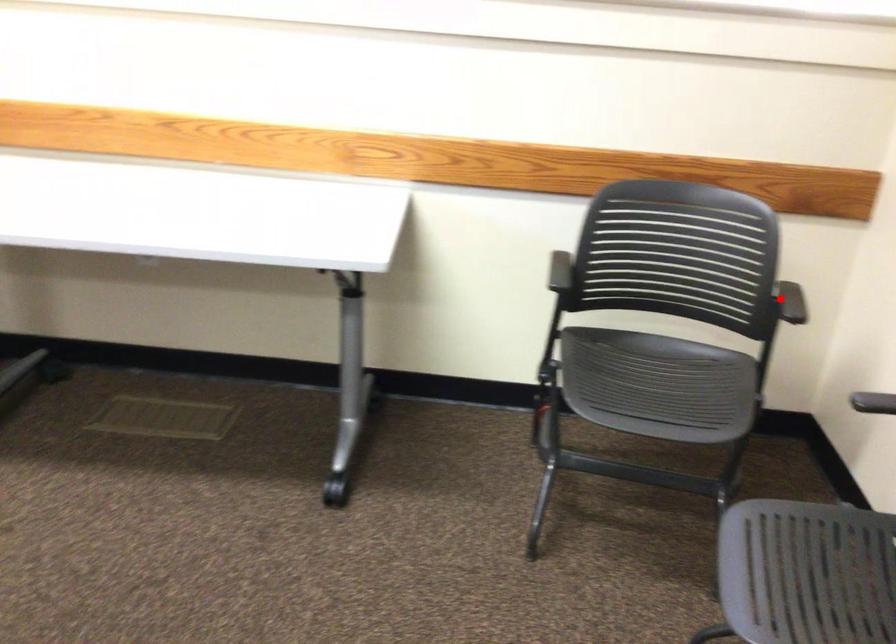
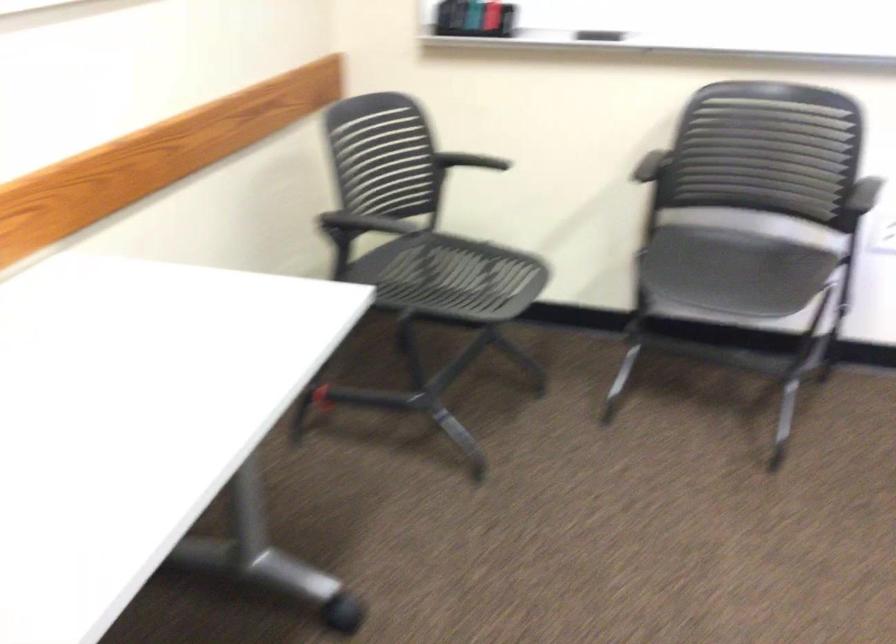
Question: I am providing you with two images of the same scene from different viewpoints. A red point is marked on the first image. Can you still see the location of the red point in image 2?

Choices:
 (A) Yes
 (B) No

Answer: (A)